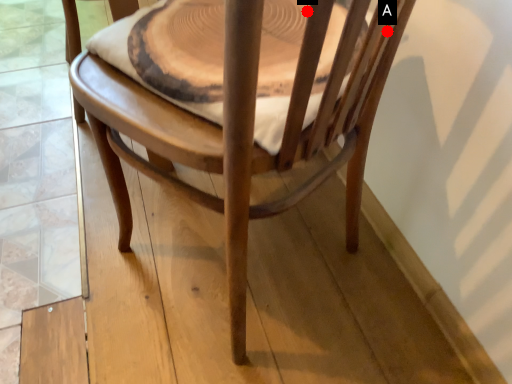
Question: Two points are circled on the image, labeled by A and B beside each circle. Among these points, which one is farthest from the camera?

Choices:
 (A) A is further
 (B) B is further

Answer: (B)